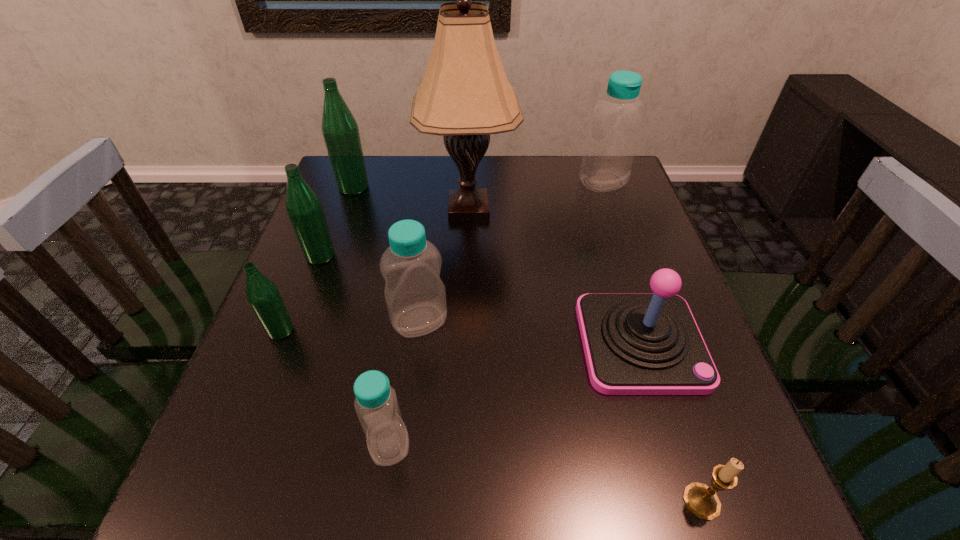
Identify the location of lamp. (465, 96).

The height and width of the screenshot is (540, 960). I want to click on the tallest object, so click(465, 96).

Identify the location of the rightmost bottle. (612, 140).

Locate an element on the screen. the farthest blue bottle is located at coordinates coord(612,140).

Locate an element on the screen. The height and width of the screenshot is (540, 960). the farthest green bottle is located at coordinates (340, 131).

This screenshot has width=960, height=540. Identify the location of the fourth nearest bottle. (304, 208).

Where is `the fourth farthest object`? the fourth farthest object is located at coordinates (304, 208).

You are a GUI agent. You are given a task and a screenshot of the screen. Output one action in this format:
    pyautogui.click(x=<x>, y=<y>)
    Task: Click on the second farthest blue bottle
    The width and height of the screenshot is (960, 540).
    Given the screenshot: What is the action you would take?
    pyautogui.click(x=415, y=295)

Locate an element on the screen. pink joystick is located at coordinates (635, 343).

What are the coordinates of `the nearest green bottle` in the screenshot? It's located at (262, 294).